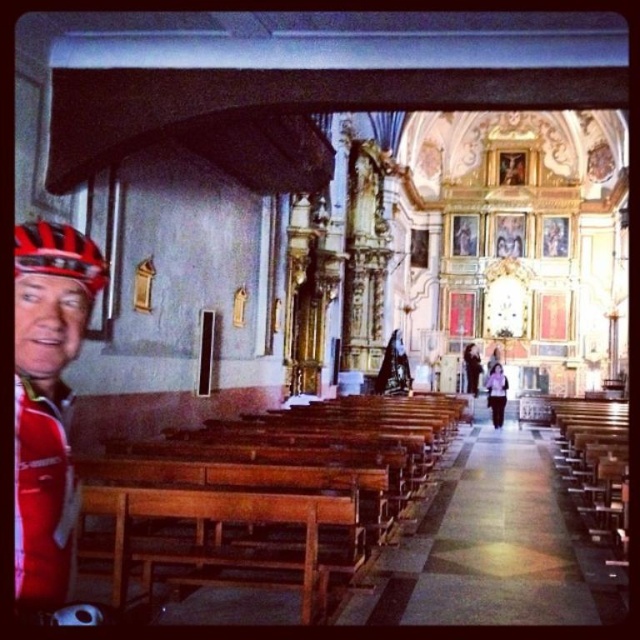
You are a visitor in the church and notice two items out of place. The red matte helmet at left and the black leather jacket at center. Which item is taller?

The red matte helmet at left is taller than the black leather jacket at center.

You are an event organizer planning a small gathering in the church. You need to place a decorative item on the altar. Which object between the purple fabric at center and the black leather jacket at center would you choose to cover the altar, and why?

The purple fabric at center has a larger size compared to the black leather jacket at center. Therefore, the purple fabric at center would be more suitable to cover the altar as it can adequately cover the space due to its larger size.

You are an interior designer planning to install a new lighting fixture above the wooden pews at center and the purple fabric at center. Which object requires a higher suspension point to avoid obstruction?

The purple fabric at center requires a higher suspension point because it is taller than the wooden pews at center.